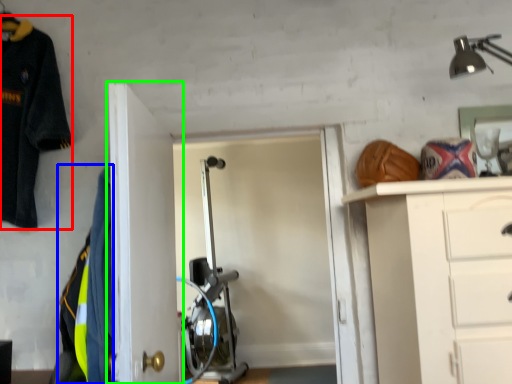
Question: Based on their relative distances, which object is nearer to uniform (highlighted by a red box)? Choose from uniform (highlighted by a blue box) and door (highlighted by a green box).

Choices:
 (A) uniform
 (B) door

Answer: (B)